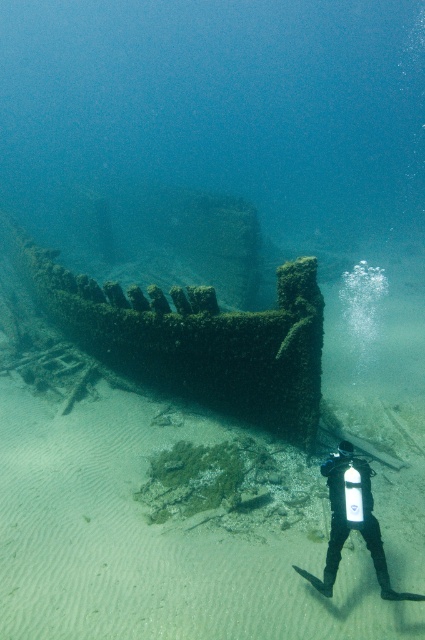
Does point (297, 300) come in front of point (336, 513)?

No.

Which of these two, rusty metal shipwreck at center or black rubber wetsuit at lower center, stands shorter?

rusty metal shipwreck at center

Image resolution: width=425 pixels, height=640 pixels. Find the location of `rusty metal shipwreck at center`. rusty metal shipwreck at center is located at coordinates (192, 337).

Where is `rusty metal shipwreck at center`? rusty metal shipwreck at center is located at coordinates (192, 337).